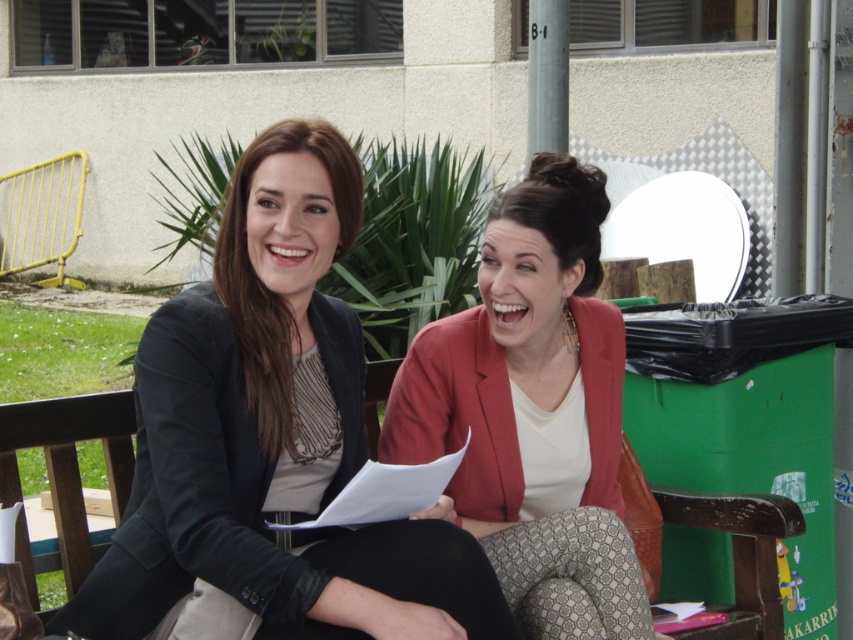
Question: Among these objects, which one is nearest to the camera?

Choices:
 (A) matte black blazer at center
 (B) matte red blazer at center

Answer: (A)

Question: Is matte black blazer at center to the right of matte red blazer at center from the viewer's perspective?

Choices:
 (A) no
 (B) yes

Answer: (A)

Question: Is matte black blazer at center wider than matte red blazer at center?

Choices:
 (A) yes
 (B) no

Answer: (A)

Question: Considering the real-world distances, which object is farthest from the wooden park bench at center?

Choices:
 (A) matte black blazer at center
 (B) matte red blazer at center

Answer: (B)

Question: Which point is farther to the camera?

Choices:
 (A) matte black blazer at center
 (B) wooden park bench at center

Answer: (B)

Question: Can you confirm if matte red blazer at center is positioned to the right of wooden park bench at center?

Choices:
 (A) yes
 (B) no

Answer: (A)